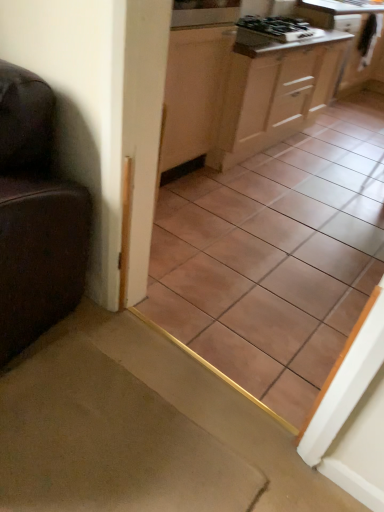
Where is `vacant space in front of light wood cabinet at center, marked as the second cabinetry in a back-to-front arrangement`? This screenshot has width=384, height=512. vacant space in front of light wood cabinet at center, marked as the second cabinetry in a back-to-front arrangement is located at coordinates (282, 194).